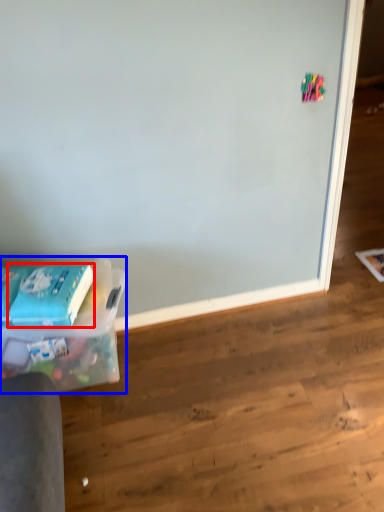
Question: Which point is closer to the camera, paperback book (highlighted by a red box) or box (highlighted by a blue box)?

Choices:
 (A) paperback book
 (B) box

Answer: (B)